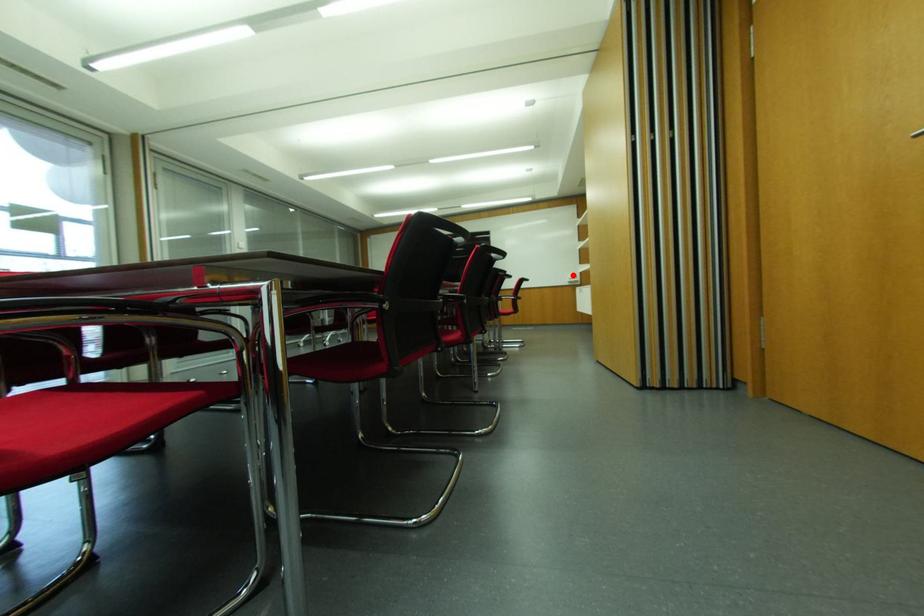
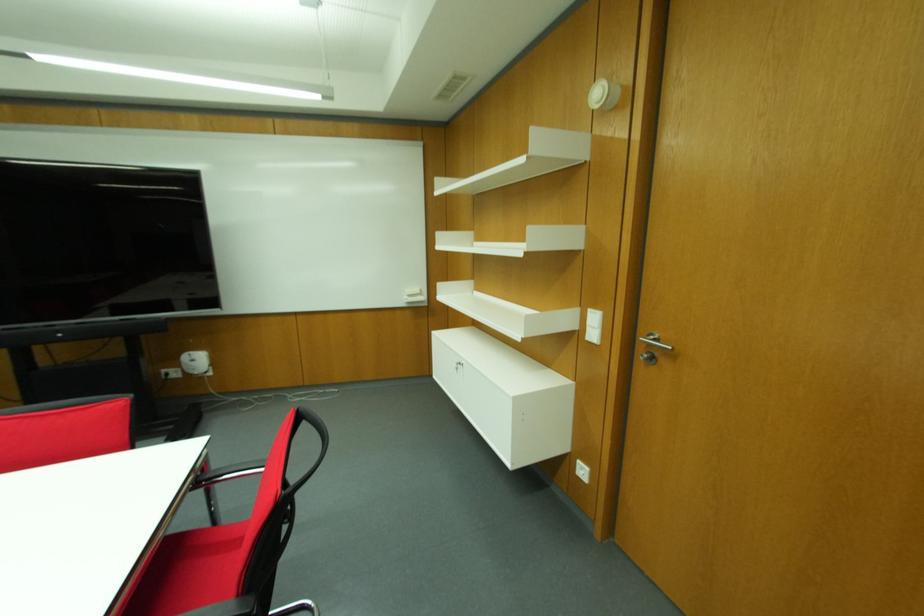
Question: I am providing you with two images of the same scene from different viewpoints. Image1 has a red point marked. In image2, the corresponding 3D location appears at what relative position? Reply with the corresponding letter.

Choices:
 (A) Closer
 (B) Farther

Answer: (B)